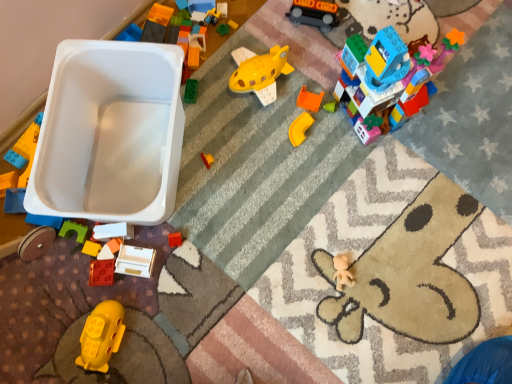
Identify the location of free space that is in between yellow matte toy submarine at lower left, which is the first toy from bottom to top, and shiny black train at upper center, which ranks as the 2th toy in right-to-left order. (210, 182).